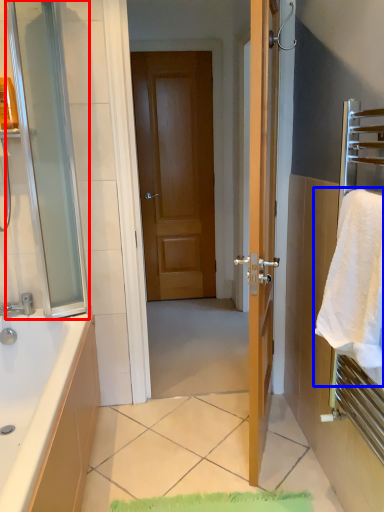
Question: Which of the following is the farthest to the observer, screen door (highlighted by a red box) or beach towel (highlighted by a blue box)?

Choices:
 (A) screen door
 (B) beach towel

Answer: (A)